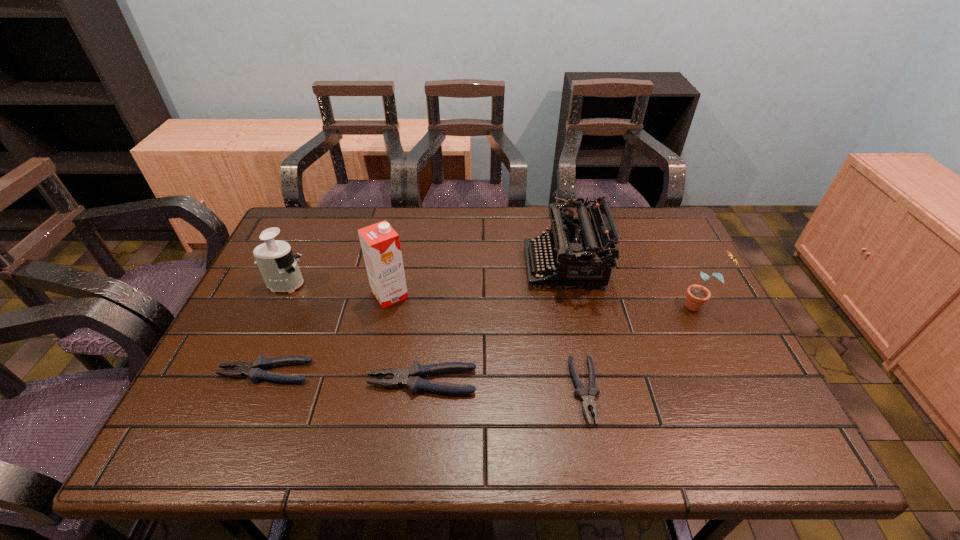
You are a GUI agent. You are given a task and a screenshot of the screen. Output one action in this format:
    pyautogui.click(x=<x>, y=<y>)
    Task: Click on the free space at the near right corner of the desktop
    
    Given the screenshot: What is the action you would take?
    pyautogui.click(x=740, y=409)

Find the location of a particular element. The width and height of the screenshot is (960, 540). free space between the juicer and the sixth tallest object is located at coordinates (275, 328).

This screenshot has height=540, width=960. What are the coordinates of `unoccupied area between the rightmost object and the tallest object` in the screenshot? It's located at (544, 300).

You are a GUI agent. You are given a task and a screenshot of the screen. Output one action in this format:
    pyautogui.click(x=<x>, y=<y>)
    Task: Click on the free spot between the typewriter and the leftmost pliers
    
    Given the screenshot: What is the action you would take?
    pyautogui.click(x=415, y=319)

Where is `empty space that is in between the sunflower and the second pliers from right to left`? This screenshot has height=540, width=960. empty space that is in between the sunflower and the second pliers from right to left is located at coordinates (561, 343).

The width and height of the screenshot is (960, 540). Identify the location of free space that is in between the second tallest pliers and the carton. (327, 334).

At what (x,y) coordinates should I click in order to perform the action: click on free area in between the carton and the second shortest object. Please return your answer as a coordinate pair (x, y). Looking at the image, I should click on (327, 334).

Locate an element on the screen. empty space that is in between the rightmost object and the juicer is located at coordinates (492, 295).

At what (x,y) coordinates should I click in order to perform the action: click on vacant point located between the shortest object and the tallest object. Please return your answer as a coordinate pair (x, y). The height and width of the screenshot is (540, 960). Looking at the image, I should click on (488, 343).

Find the location of a particular element. The width and height of the screenshot is (960, 540). vacant area that lies between the tallest object and the second pliers from right to left is located at coordinates (406, 338).